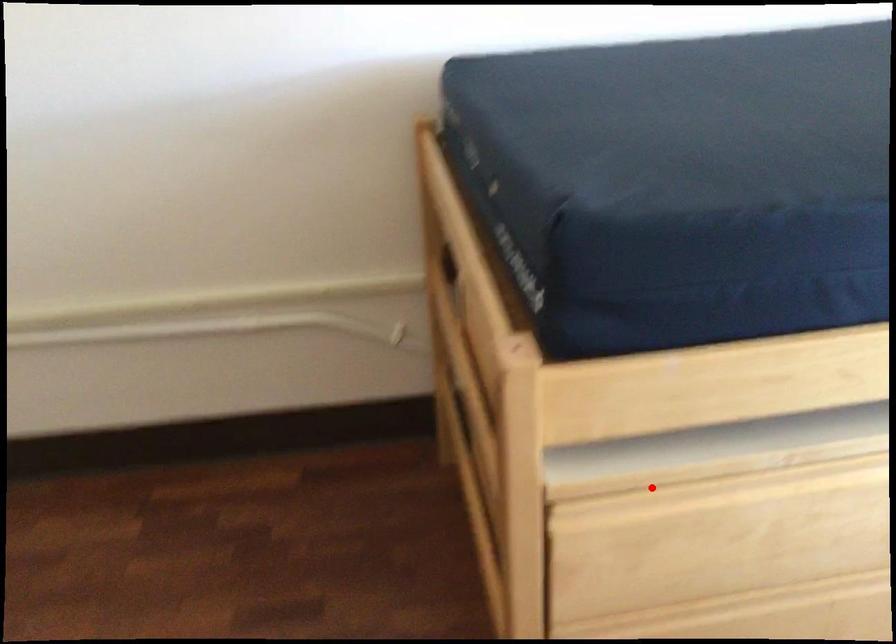
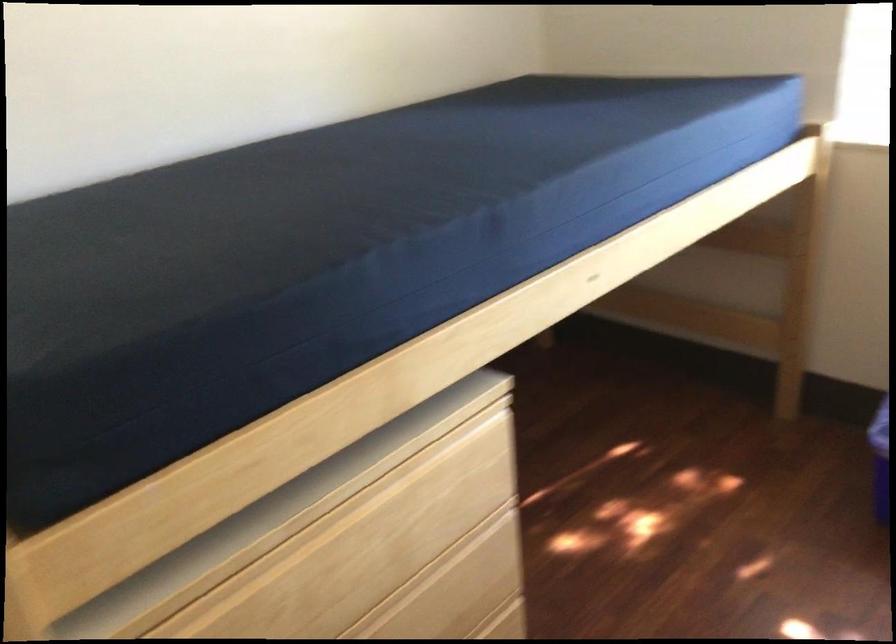
Find the pixel in the second image that matches the highlighted location in the first image.

(186, 611)